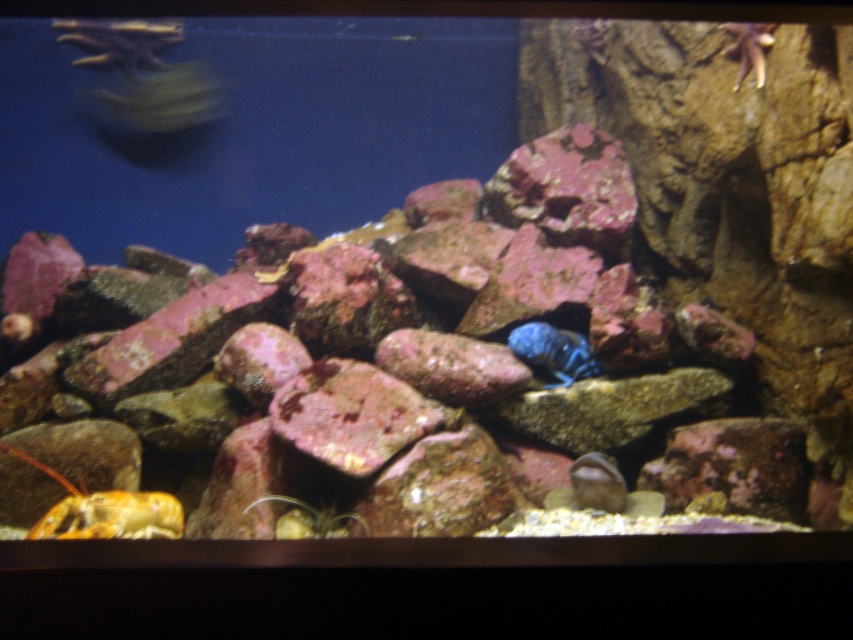
Question: Is shiny orange hermit crab at lower left closer to the viewer compared to matte brown rock at lower center?

Choices:
 (A) no
 (B) yes

Answer: (B)

Question: Which of the following is the farthest from the observer?

Choices:
 (A) shiny orange hermit crab at lower left
 (B) blue glossy fish at center

Answer: (B)

Question: Is blue glossy fish at center to the right of matte brown rock at lower center from the viewer's perspective?

Choices:
 (A) yes
 (B) no

Answer: (B)

Question: Which of the following is the closest to the observer?

Choices:
 (A) (592, 458)
 (B) (532, 346)

Answer: (A)

Question: Which point appears closest to the camera in this image?

Choices:
 (A) (582, 497)
 (B) (527, 328)

Answer: (A)

Question: Does shiny orange hermit crab at lower left have a larger size compared to matte brown rock at lower center?

Choices:
 (A) no
 (B) yes

Answer: (B)